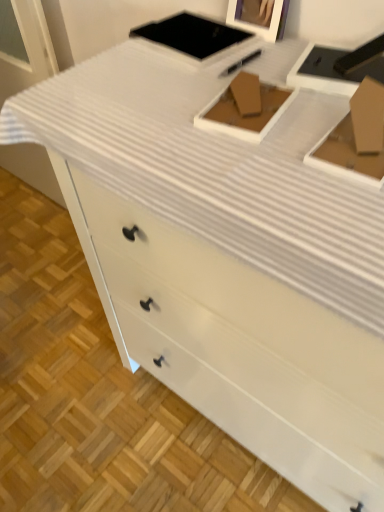
This screenshot has height=512, width=384. Find the location of `vacant space in front of wooden picture frame at upper center`. vacant space in front of wooden picture frame at upper center is located at coordinates (249, 59).